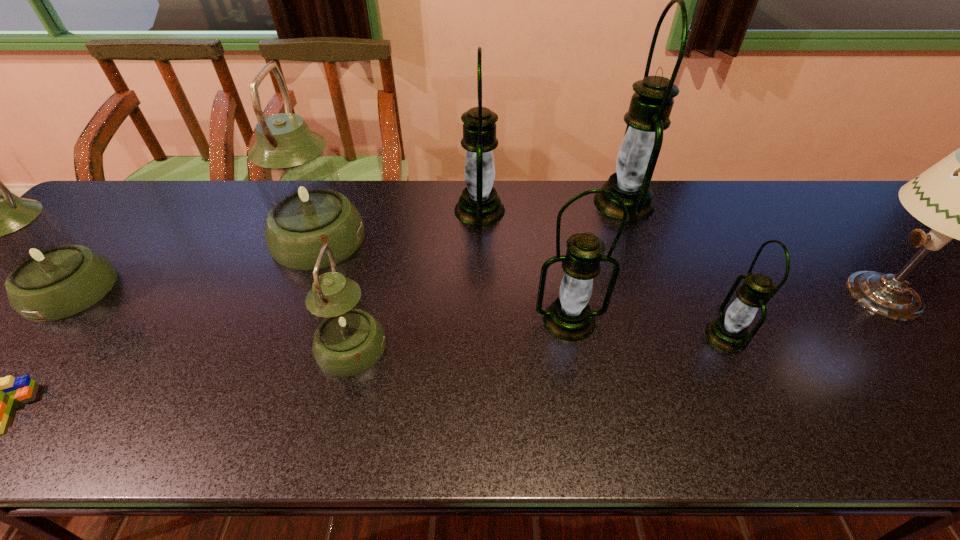
The width and height of the screenshot is (960, 540). In order to click on greenish lantern that is the third closest to the rightmost object in this screenshot , I will do `click(48, 276)`.

Identify which greenish lantern is the closest to the biggest greenish lantern. Please provide its 2D coordinates. Your answer should be formatted as a tuple, i.e. [(x, y)], where the tuple contains the x and y coordinates of a point satisfying the conditions above.

[(347, 341)]

You are a GUI agent. You are given a task and a screenshot of the screen. Output one action in this format:
    pyautogui.click(x=<x>, y=<y>)
    Task: Click on the free space that satisfies the following two spatial constraints: 1. on the lampshade of the lampshade; 2. on the side where the fifth lantern from left to right emits light
    The height and width of the screenshot is (540, 960).
    Given the screenshot: What is the action you would take?
    pyautogui.click(x=904, y=320)